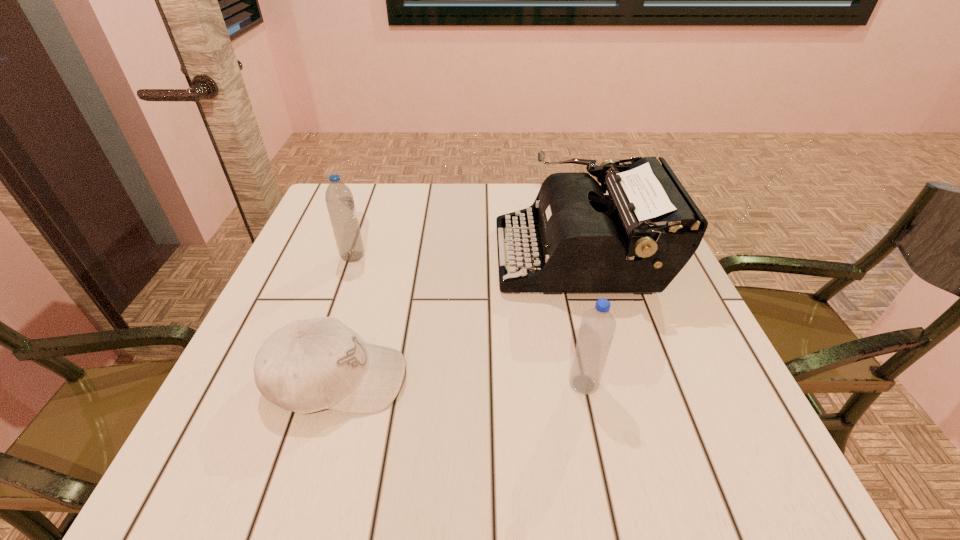
The height and width of the screenshot is (540, 960). I want to click on the left water bottle, so click(x=339, y=199).

This screenshot has width=960, height=540. Find the location of `typewriter`. typewriter is located at coordinates (637, 238).

At what (x,y) coordinates should I click in order to perform the action: click on the right water bottle. Please return your answer as a coordinate pair (x, y). The width and height of the screenshot is (960, 540). Looking at the image, I should click on (598, 325).

Locate an element on the screen. The width and height of the screenshot is (960, 540). the shortest object is located at coordinates (308, 365).

The image size is (960, 540). I want to click on vacant region located 0.230m on the right of the farther water bottle, so click(462, 257).

I want to click on free region located on the typing side of the typewriter, so click(x=384, y=256).

This screenshot has width=960, height=540. I want to click on vacant region located 0.330m on the typing side of the typewriter, so click(359, 256).

Find the location of a particular element. vacant space positioned 0.120m on the typing side of the typewriter is located at coordinates point(447,256).

The height and width of the screenshot is (540, 960). Find the location of `free space located on the left of the right water bottle`. free space located on the left of the right water bottle is located at coordinates (495, 384).

The image size is (960, 540). I want to click on free space located 0.100m on the front-facing side of the shortest object, so click(x=462, y=379).